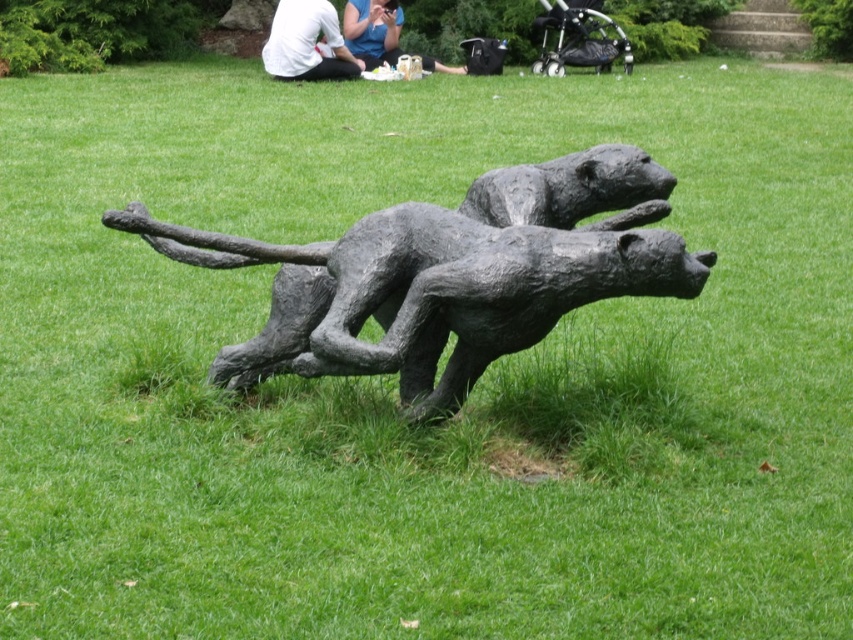
Question: Which of these objects is positioned farthest from the bronze textured sculpture at center?

Choices:
 (A) white shirt at upper center
 (B) white cotton shirt at upper center

Answer: (B)

Question: Considering the relative positions of bronze textured sculpture at center and white cotton shirt at upper center in the image provided, where is bronze textured sculpture at center located with respect to white cotton shirt at upper center?

Choices:
 (A) above
 (B) below

Answer: (B)

Question: Is bronze textured sculpture at center bigger than white shirt at upper center?

Choices:
 (A) yes
 (B) no

Answer: (A)

Question: Is bronze textured sculpture at center closer to camera compared to white shirt at upper center?

Choices:
 (A) yes
 (B) no

Answer: (A)

Question: Which object appears closest to the camera in this image?

Choices:
 (A) white shirt at upper center
 (B) bronze textured sculpture at center

Answer: (B)

Question: Which is nearer to the white cotton shirt at upper center?

Choices:
 (A) bronze textured sculpture at center
 (B) white shirt at upper center

Answer: (B)